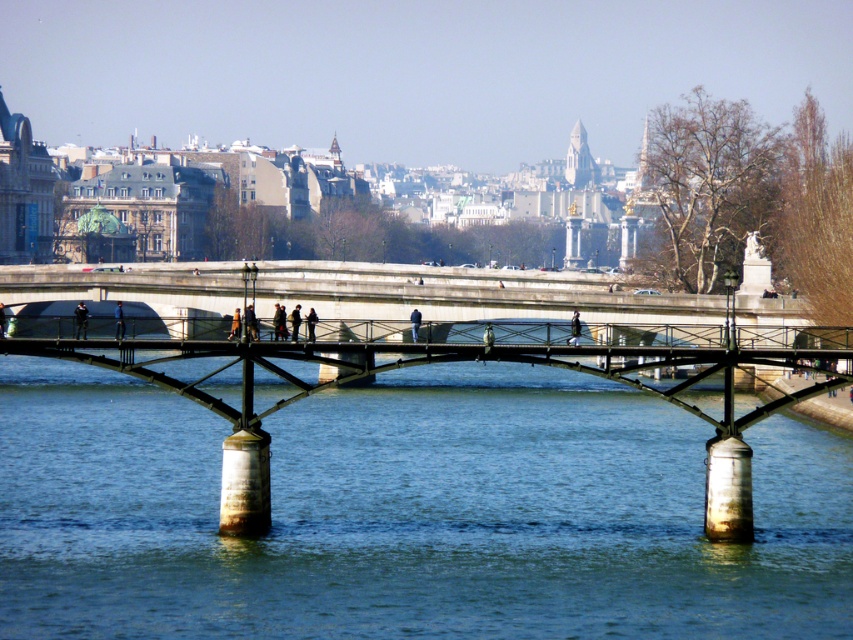
Question: Can you confirm if blue water at center is positioned above blue fabric pedestrian at center?

Choices:
 (A) no
 (B) yes

Answer: (A)

Question: Which object is positioned farthest from the dark blue jeans at center?

Choices:
 (A) dark blue fabric jacket at center
 (B) blue water at center
 (C) blue fabric pedestrian at center

Answer: (B)

Question: Can you confirm if blue water at center is wider than dark blue fabric jacket at center?

Choices:
 (A) no
 (B) yes

Answer: (B)

Question: Is blue water at center further to camera compared to dark blue jeans at center?

Choices:
 (A) no
 (B) yes

Answer: (A)

Question: Which object is closer to the camera taking this photo?

Choices:
 (A) blue water at center
 (B) blue fabric pedestrian at center
 (C) dark blue fabric jacket at center

Answer: (A)

Question: Among these objects, which one is farthest from the camera?

Choices:
 (A) dark blue fabric jacket at center
 (B) blue water at center
 (C) dark blue jeans at center

Answer: (C)